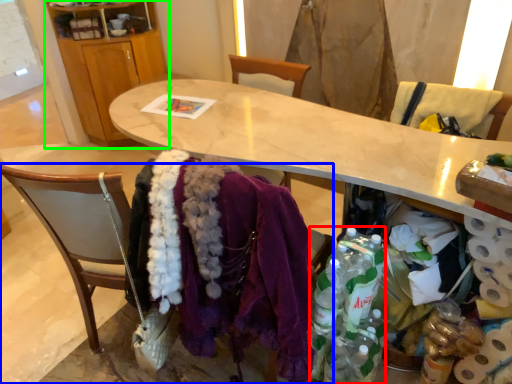
Question: Which is nearer to the bottle (highlighted by a red box)? chair (highlighted by a blue box) or cabinetry (highlighted by a green box).

Choices:
 (A) chair
 (B) cabinetry

Answer: (A)